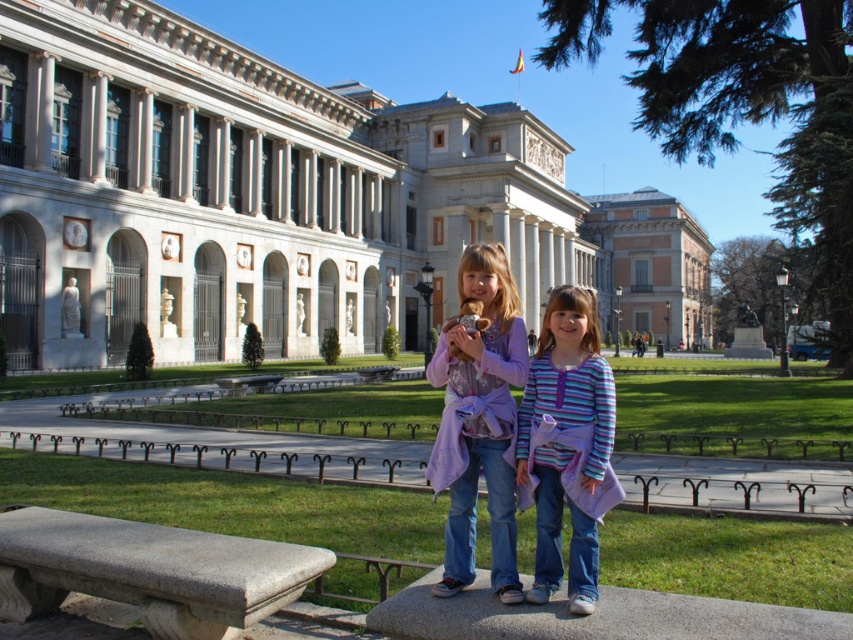
You are a photographer trying to capture a photo of the two girls on the bench. You want to ensure both the purple fabric dress at center and the striped fabric shirt at center are in focus. Given that your camera has a depth of field that can cover 36 inches, will both items be in focus?

The distance between the purple fabric dress at center and the striped fabric shirt at center is 36.27 inches. Since the camera can only cover 36 inches, the depth of field is insufficient to keep both items in focus.